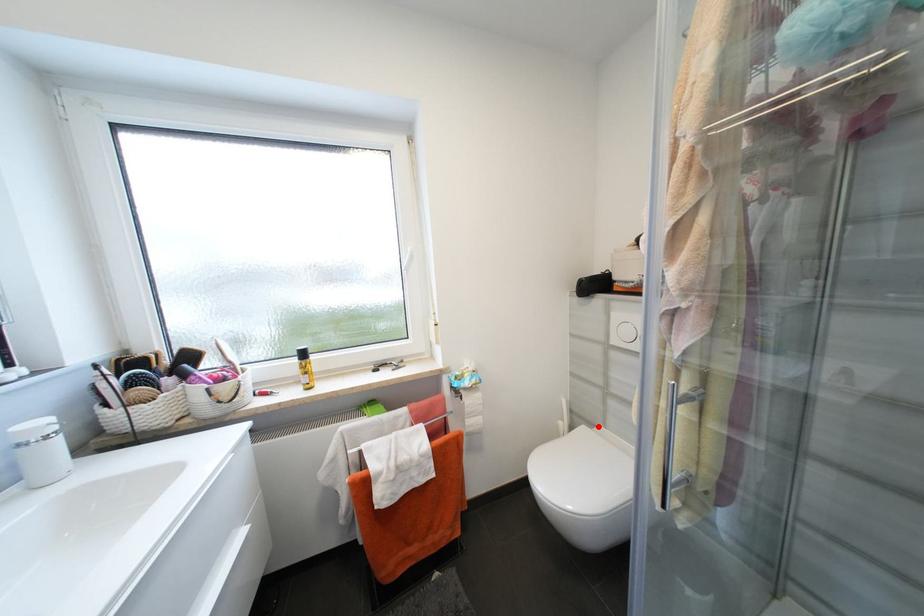
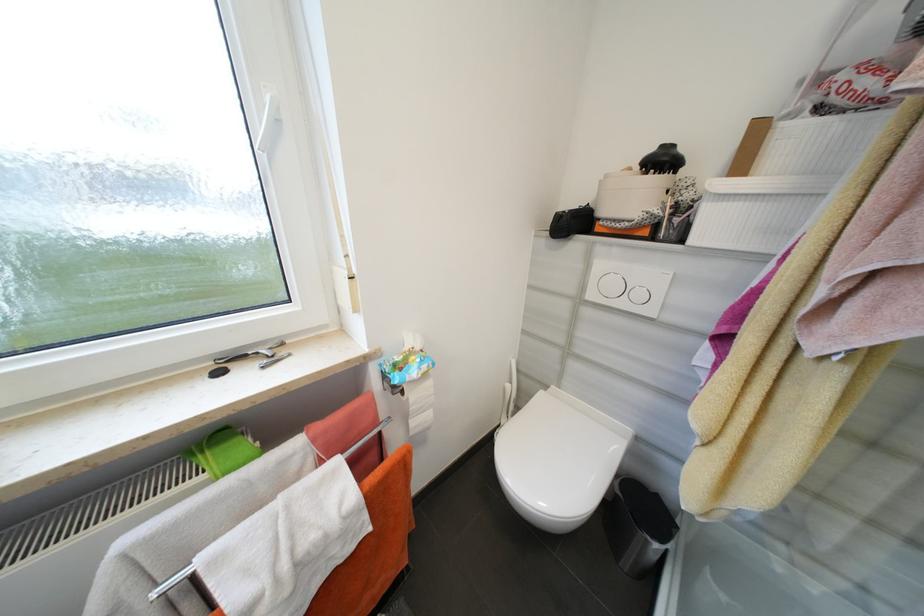
In the second image, find the point that corresponds to the highlighted location in the first image.

(552, 387)